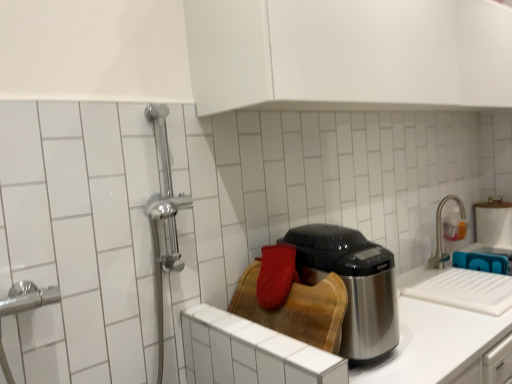
I want to click on vacant point to the right of shiny metallic appliance at center, so click(x=431, y=340).